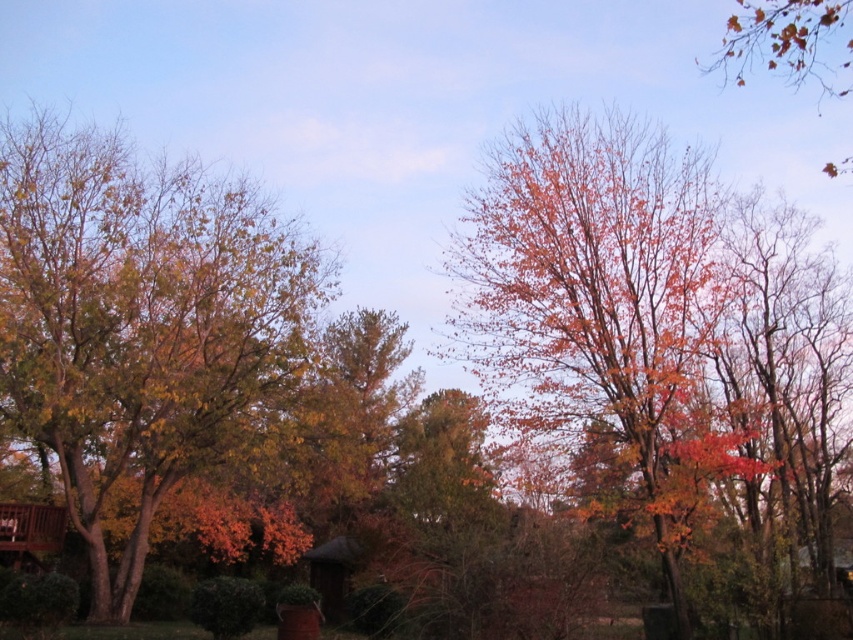
You are standing at the center of a autumnal scene with various trees and a wooden structure. You notice a point marked at coordinates [659,336]. What can you find at that point?

At point [659,336] lies shiny orange leaves at center.